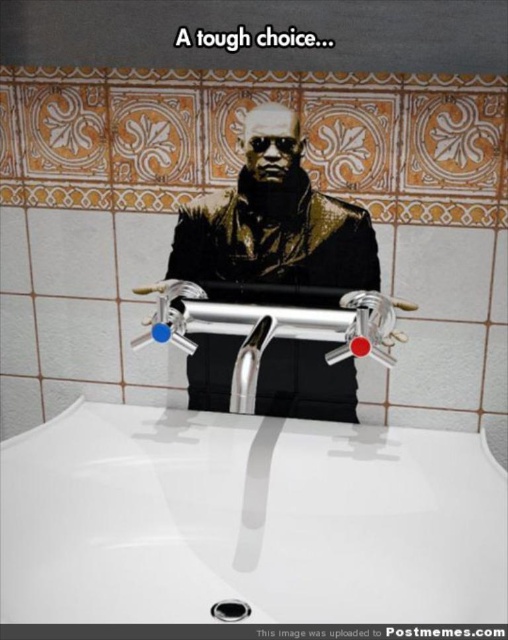
Does white glossy sink at center have a greater width compared to silver metallic faucet at center?

Indeed, white glossy sink at center has a greater width compared to silver metallic faucet at center.

Does white glossy sink at center lie in front of silver metallic faucet at center?

Yes, it is.

What do you see at coordinates (247, 520) in the screenshot? I see `white glossy sink at center` at bounding box center [247, 520].

Locate an element on the screen. The image size is (508, 640). white glossy sink at center is located at coordinates (247, 520).

Does point (233, 392) lie in front of point (235, 387)?

No.

Looking at this image, who is taller, polished chrome faucet at center or silver metallic faucet at center?

polished chrome faucet at center is taller.

Between point (386, 333) and point (245, 356), which one is positioned behind?

The point (386, 333) is behind.

Where is `polished chrome faucet at center`? Image resolution: width=508 pixels, height=640 pixels. polished chrome faucet at center is located at coordinates (271, 328).

You are a GUI agent. You are given a task and a screenshot of the screen. Output one action in this format:
    pyautogui.click(x=<x>, y=<y>)
    Task: Click on the polished chrome faucet at center
    
    Given the screenshot: What is the action you would take?
    pyautogui.click(x=271, y=328)

Which is in front, point (239, 397) or point (232, 602)?

Point (239, 397)

Where is `polished chrome faucet at center`? The image size is (508, 640). polished chrome faucet at center is located at coordinates pyautogui.click(x=271, y=328).